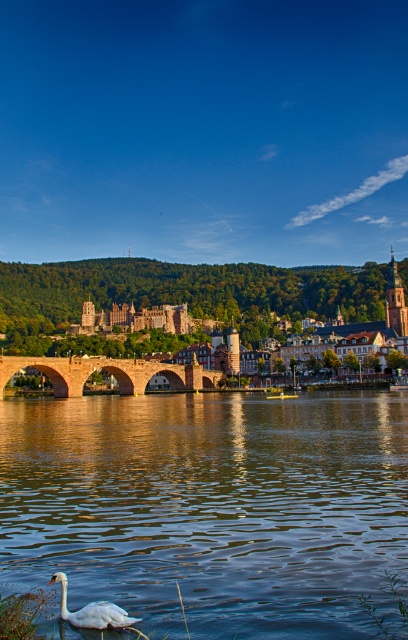
Does clear water at river center have a smaller size compared to brown stone bridge at center?

Yes, clear water at river center is smaller than brown stone bridge at center.

Between point (195, 426) and point (210, 285), which one is positioned in front?

Point (195, 426)

The image size is (408, 640). What are the coordinates of `clear water at river center` in the screenshot? It's located at (210, 508).

Is point (124, 365) more distant than point (110, 618)?

Yes, it is.

Which is behind, point (124, 381) or point (132, 621)?

The point (124, 381) is more distant.

Find the location of `stone arch bridge at center`. stone arch bridge at center is located at coordinates (110, 371).

You are a GUI agent. You are given a task and a screenshot of the screen. Output one action in this format:
    pyautogui.click(x=<x>, y=<y>)
    Task: Click on the stone arch bridge at center
    
    Given the screenshot: What is the action you would take?
    pyautogui.click(x=110, y=371)

Which of these two, brown stone bridge at center or white glossy swan at lower left, stands shorter?

white glossy swan at lower left

Can you confirm if brown stone bridge at center is positioned below white glossy swan at lower left?

No, brown stone bridge at center is not below white glossy swan at lower left.

Where is `brown stone bridge at center`? brown stone bridge at center is located at coordinates (179, 296).